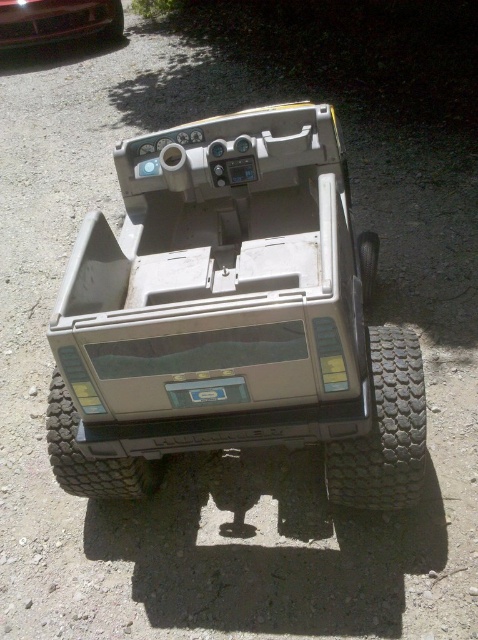
Can you confirm if matte gray jeep at center is taller than shiny black car at upper left?

Yes.

Locate an element on the screen. This screenshot has width=478, height=640. matte gray jeep at center is located at coordinates (230, 317).

Who is lower down, matte gray jeep at center or dark gray rugged tire at bottom center?

dark gray rugged tire at bottom center is lower down.

Image resolution: width=478 pixels, height=640 pixels. What do you see at coordinates (230, 317) in the screenshot? I see `matte gray jeep at center` at bounding box center [230, 317].

Find the location of a particular element. The height and width of the screenshot is (640, 478). matte gray jeep at center is located at coordinates (230, 317).

At what (x,y) coordinates should I click in order to perform the action: click on dark gray rugged tire at bottom center. Please return your answer as a coordinate pair (x, y). This screenshot has width=478, height=640. Looking at the image, I should click on (93, 458).

Does dark gray rugged tire at bottom center have a lesser width compared to black rubber wheel at lower left?

Incorrect, dark gray rugged tire at bottom center's width is not less than black rubber wheel at lower left's.

Which is behind, point (64, 444) or point (118, 20)?

The point (118, 20) is more distant.

Where is `dark gray rugged tire at bottom center`? The width and height of the screenshot is (478, 640). dark gray rugged tire at bottom center is located at coordinates (93, 458).